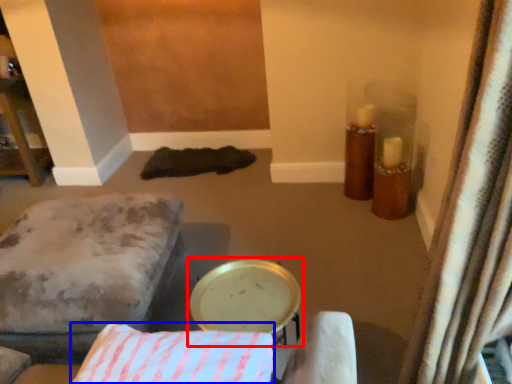
Question: Which object appears closest to the camera in this image, round table (highlighted by a red box) or pillow (highlighted by a blue box)?

Choices:
 (A) round table
 (B) pillow

Answer: (B)